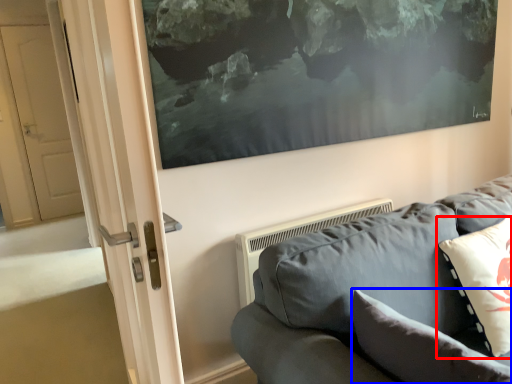
Question: Which object appears closest to the camera in this image, pillow (highlighted by a red box) or pillow (highlighted by a blue box)?

Choices:
 (A) pillow
 (B) pillow

Answer: (B)